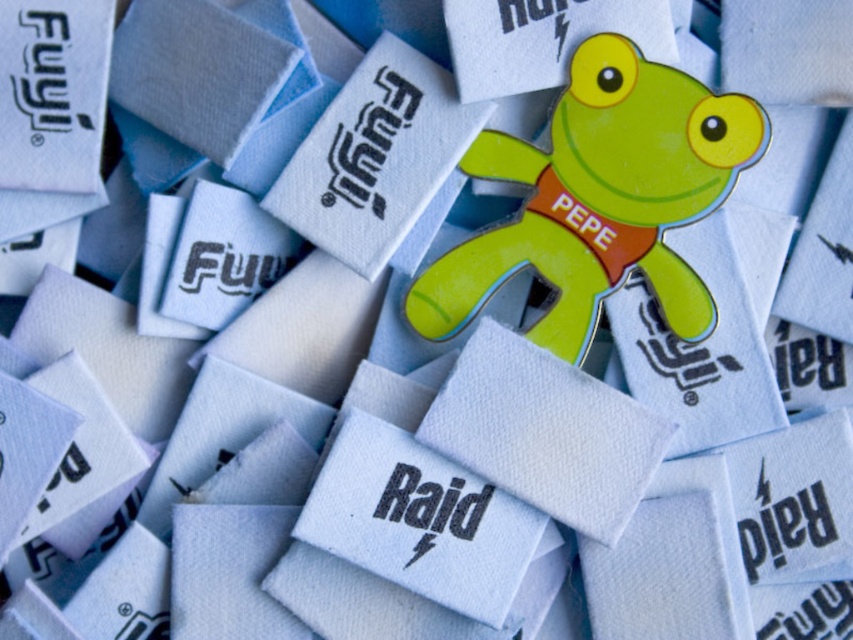
Is black matte text at center taller than matte white text at center?

Indeed, black matte text at center has a greater height compared to matte white text at center.

Based on the photo, is black matte text at center closer to camera compared to matte white text at center?

Yes, it is.

Which is in front, point (665, 333) or point (200, 259)?

Point (665, 333) is in front.

You are a GUI agent. You are given a task and a screenshot of the screen. Output one action in this format:
    pyautogui.click(x=<x>, y=<y>)
    Task: Click on the black matte text at center
    The image size is (853, 640).
    Given the screenshot: What is the action you would take?
    pyautogui.click(x=682, y=355)

Which is above, glossy plastic frog at center or black matte text at upper center?

Positioned higher is black matte text at upper center.

Does glossy plastic frog at center have a lesser width compared to black matte text at upper center?

In fact, glossy plastic frog at center might be wider than black matte text at upper center.

The image size is (853, 640). What do you see at coordinates (601, 198) in the screenshot?
I see `glossy plastic frog at center` at bounding box center [601, 198].

Find the location of a particular element. glossy plastic frog at center is located at coordinates (601, 198).

Is the position of black rubber fuji at upper left more distant than that of matte white text at center?

No, it is in front of matte white text at center.

In order to click on black rubber fuji at upper left in this screenshot , I will do `click(51, 61)`.

Does point (96, 124) come in front of point (231, 278)?

Yes, it is in front of point (231, 278).

Where is `black rubber fuji at upper left`? Image resolution: width=853 pixels, height=640 pixels. black rubber fuji at upper left is located at coordinates (51, 61).